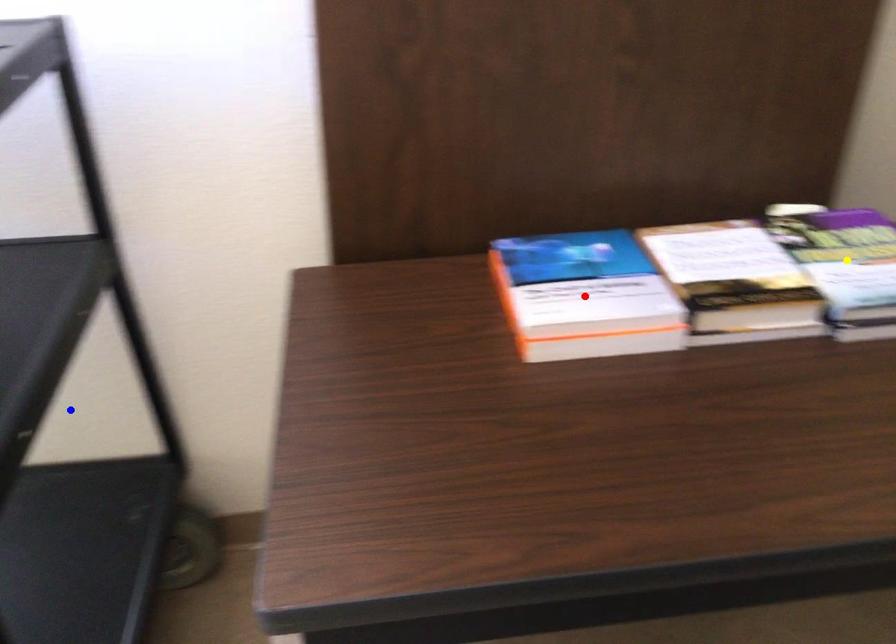
Order these from nearest to farthest:
red point
yellow point
blue point

1. blue point
2. yellow point
3. red point